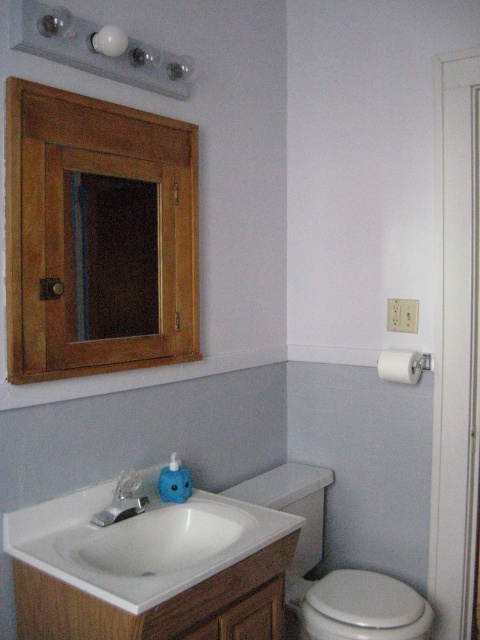
Question: Is wooden medicine cabinet at upper left behind silver metallic faucet at sink left?

Choices:
 (A) no
 (B) yes

Answer: (A)

Question: Does wooden medicine cabinet at upper left lie in front of white glossy sink at lower left?

Choices:
 (A) no
 (B) yes

Answer: (A)

Question: Which object is closer to the camera taking this photo?

Choices:
 (A) white glossy toilet at lower right
 (B) wooden frame at upper left
 (C) silver metallic faucet at sink left
 (D) wooden medicine cabinet at upper left

Answer: (D)

Question: Which of the following is the farthest from the observer?

Choices:
 (A) (52, 244)
 (B) (146, 497)

Answer: (B)

Question: Is white glossy sink at lower left positioned before white glossy toilet at lower right?

Choices:
 (A) no
 (B) yes

Answer: (B)

Question: Which object is the closest to the white glossy toilet at lower right?

Choices:
 (A) wooden medicine cabinet at upper left
 (B) white matte toilet paper at right
 (C) silver metallic faucet at sink left

Answer: (B)